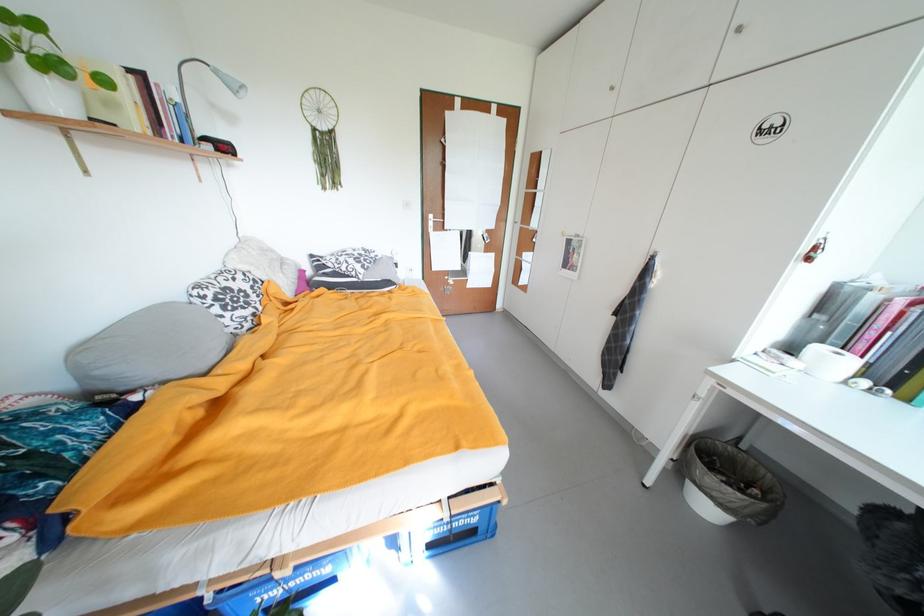
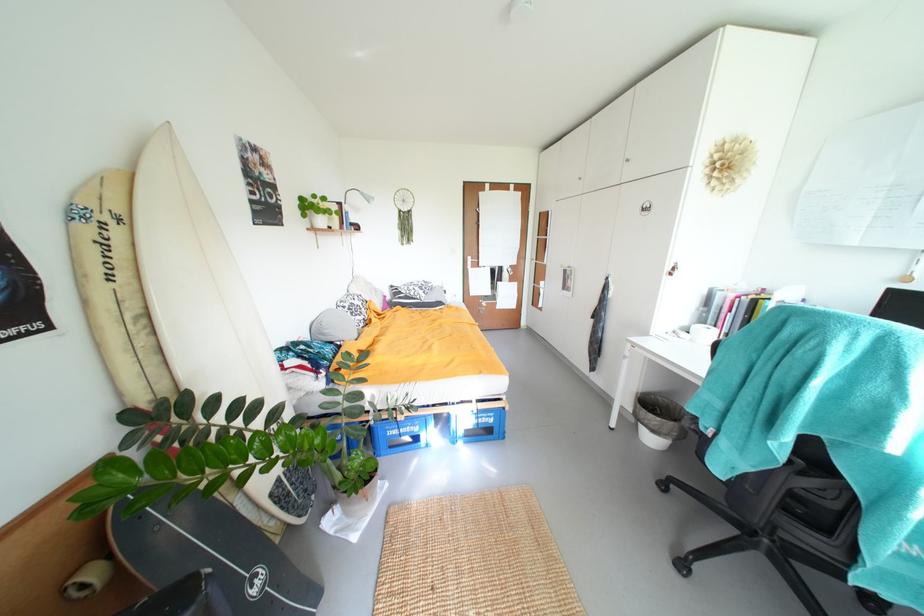
In the second image, find the point that corresponds to (x=714, y=509) in the first image.

(659, 442)